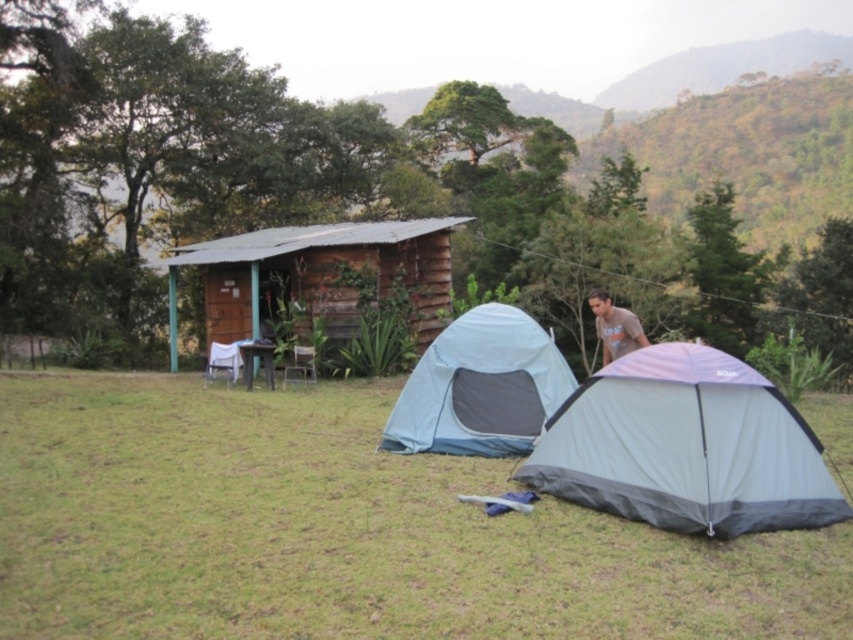
Question: Among these objects, which one is farthest from the camera?

Choices:
 (A) matte blue tent at center
 (B) gray/black fabric tent at right
 (C) brown cotton shirt at upper right
 (D) green grass at lower center

Answer: (A)

Question: Does wooden log cabin at center lie in front of matte blue tent at center?

Choices:
 (A) no
 (B) yes

Answer: (A)

Question: Can you confirm if green grass at lower center is positioned above wooden log cabin at center?

Choices:
 (A) no
 (B) yes

Answer: (A)

Question: Does gray/black fabric tent at right have a larger size compared to matte blue tent at center?

Choices:
 (A) no
 (B) yes

Answer: (B)

Question: Which of these objects is positioned closest to the brown cotton shirt at upper right?

Choices:
 (A) gray/black fabric tent at right
 (B) matte blue tent at center
 (C) wooden log cabin at center

Answer: (B)

Question: Estimate the real-world distances between objects in this image. Which object is farther from the brown cotton shirt at upper right?

Choices:
 (A) wooden log cabin at center
 (B) matte blue tent at center
 (C) green grass at lower center
 (D) gray/black fabric tent at right

Answer: (A)